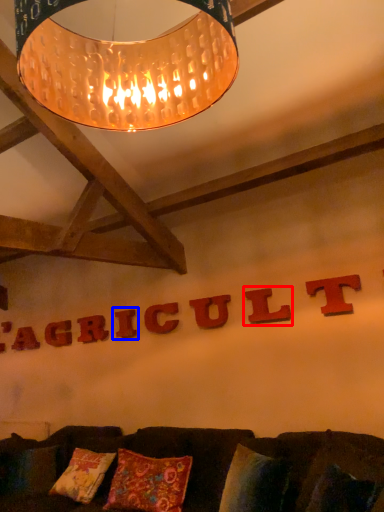
Question: Which object appears closest to the camera in this image, letter (highlighted by a red box) or letter (highlighted by a blue box)?

Choices:
 (A) letter
 (B) letter

Answer: (A)